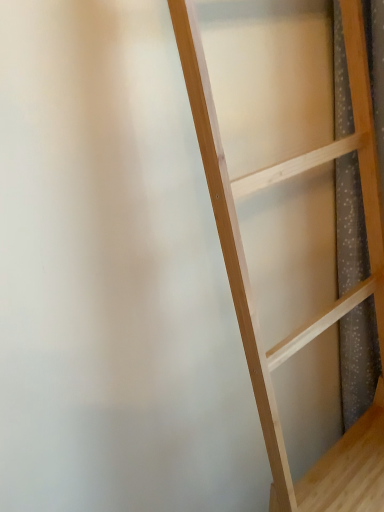
Question: Should I look upward or downward to see natural wood ladder at center?

Choices:
 (A) up
 (B) down

Answer: (B)